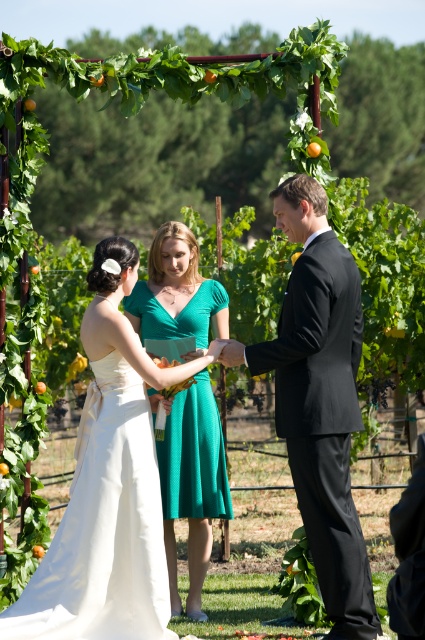
Question: Which of the following is the closest to the observer?

Choices:
 (A) emerald green satin dress at center
 (B) black satin suit at center
 (C) satin white dress at center

Answer: (C)

Question: Which of the following is the farthest from the observer?

Choices:
 (A) emerald green satin dress at center
 (B) black satin suit at center
 (C) satin white dress at center

Answer: (A)

Question: Can you confirm if satin white dress at center is thinner than black satin suit at center?

Choices:
 (A) no
 (B) yes

Answer: (A)

Question: Which object appears farthest from the camera in this image?

Choices:
 (A) satin white dress at center
 (B) black satin suit at center
 (C) emerald green satin dress at center

Answer: (C)

Question: Does black satin suit at center have a smaller size compared to emerald green satin dress at center?

Choices:
 (A) yes
 (B) no

Answer: (A)

Question: Does black satin suit at center have a greater width compared to emerald green satin dress at center?

Choices:
 (A) yes
 (B) no

Answer: (A)